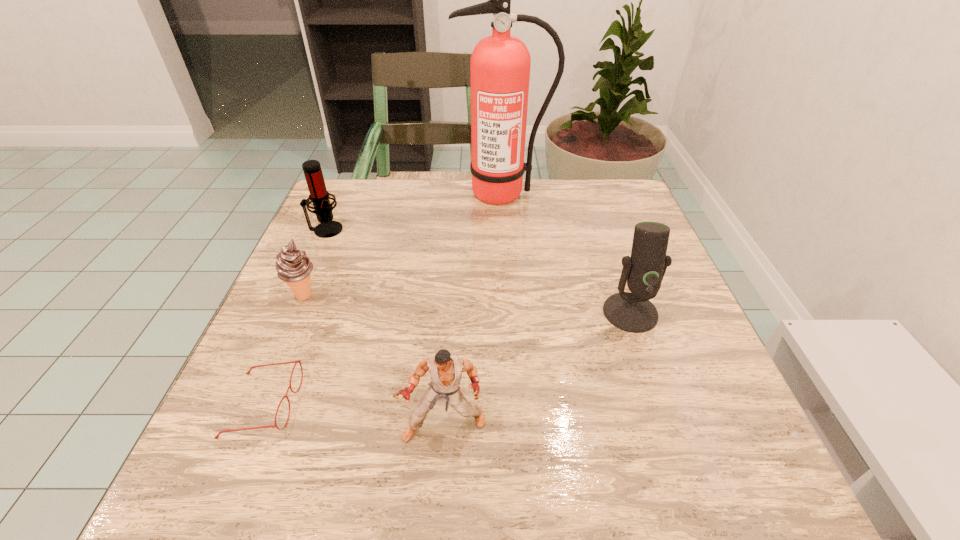
This screenshot has width=960, height=540. What are the coordinates of `spectacles that is positioned at the left edge` in the screenshot? It's located at (298, 361).

At what (x,y) coordinates should I click in order to perform the action: click on object that is positioned at the right edge. Please return your answer as a coordinate pair (x, y). This screenshot has width=960, height=540. Looking at the image, I should click on click(x=632, y=312).

You are a GUI agent. You are given a task and a screenshot of the screen. Output one action in this format:
    pyautogui.click(x=<x>, y=<y>)
    Task: Click on the object that is at the far left corner
    This screenshot has width=960, height=540.
    Given the screenshot: What is the action you would take?
    pyautogui.click(x=319, y=196)

The width and height of the screenshot is (960, 540). Find the location of `vacant space at the far edge`. vacant space at the far edge is located at coordinates (457, 181).

Locate an element on the screen. blank space at the near edge of the desktop is located at coordinates (615, 448).

Find the location of a particular element. This screenshot has height=540, width=960. vacant space at the left edge of the desktop is located at coordinates (269, 409).

In the image, there is a desktop. Identify the location of vacant space at the right edge. This screenshot has width=960, height=540. tap(717, 409).

Where is `vacant area at the far left corner`? The width and height of the screenshot is (960, 540). vacant area at the far left corner is located at coordinates (365, 191).

This screenshot has width=960, height=540. What are the coordinates of `free space at the near left corner of the desktop` in the screenshot? It's located at (216, 502).

You are a GUI agent. You are given a task and a screenshot of the screen. Output one action in this format:
    pyautogui.click(x=<x>, y=<y>)
    Task: Click on the vacant area at the far right corner of the desktop
    
    Given the screenshot: What is the action you would take?
    (x=598, y=212)